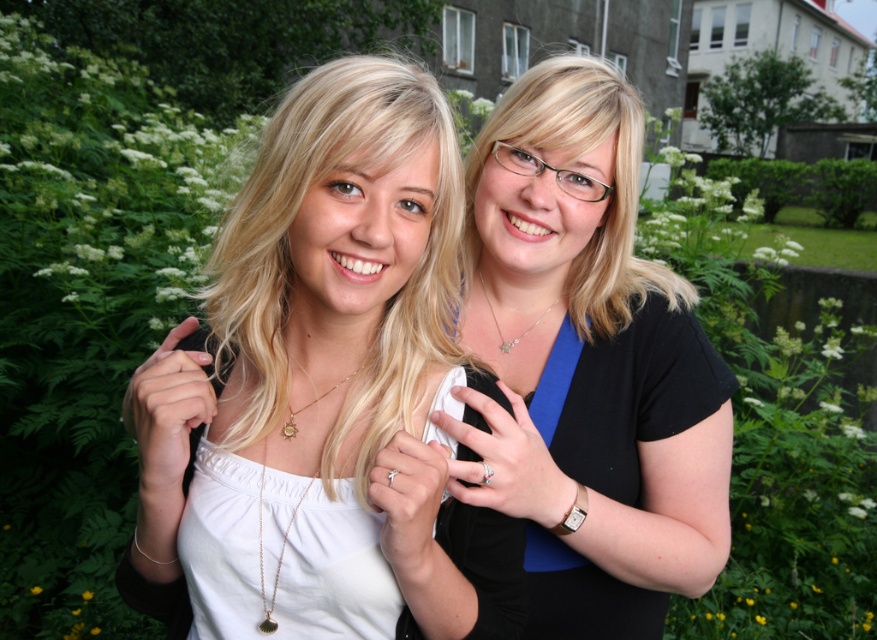
Which is behind, point (324, 240) or point (593, 573)?

Positioned behind is point (593, 573).

Does white matte shirt at center have a smaller size compared to black matte shirt at center?

Yes.

Who is more distant from viewer, (127, 552) or (667, 376)?

The point (667, 376) is more distant.

Where is `white matte shirt at center`? white matte shirt at center is located at coordinates (323, 392).